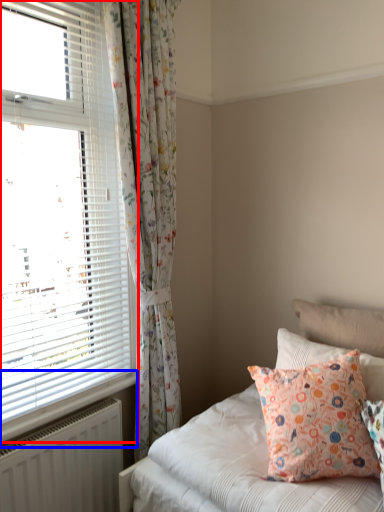
Question: Which point is further to the camera, window (highlighted by a red box) or window sill (highlighted by a blue box)?

Choices:
 (A) window
 (B) window sill

Answer: (B)